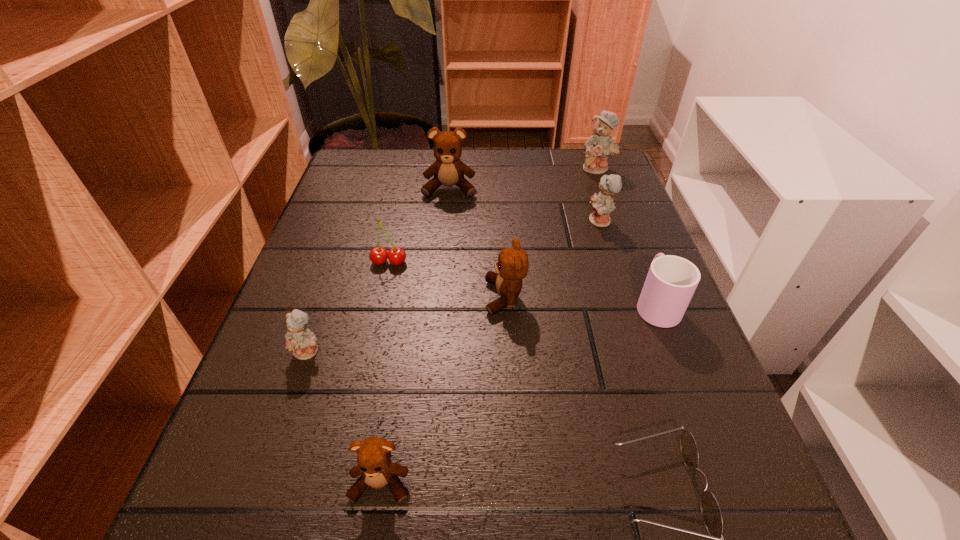
Locate an element on the screen. teddy bear that can be found as the second closest to the smallest blue teddy bear is located at coordinates (512, 266).

Identify which brown teddy bear is the third nearest to the second nearest blue teddy bear. Please provide its 2D coordinates. Your answer should be formatted as a tuple, i.e. [(x, y)], where the tuple contains the x and y coordinates of a point satisfying the conditions above.

[(374, 460)]

I want to click on brown teddy bear that is the second closest to the farthest brown teddy bear, so click(374, 460).

Point out which blue teddy bear is positioned as the nearest to the third farthest teddy bear. Please provide its 2D coordinates. Your answer should be formatted as a tuple, i.e. [(x, y)], where the tuple contains the x and y coordinates of a point satisfying the conditions above.

[(598, 147)]

Identify the location of blue teddy bear that is the closest one to the biggest blue teddy bear. This screenshot has height=540, width=960. (602, 204).

I want to click on free location that satisfies the following two spatial constraints: 1. on the front-facing side of the second farthest blue teddy bear; 2. with the handle on the side of the cup, so click(627, 304).

This screenshot has width=960, height=540. What are the coordinates of `blank space that satisfies the following two spatial constraints: 1. on the front-facing side of the farthest object; 2. on the front-facing side of the fourth teddy bear from left to right` in the screenshot? It's located at (644, 297).

The image size is (960, 540). I want to click on free space that satisfies the following two spatial constraints: 1. with the handle on the side of the cup; 2. on the front-facing side of the third nearest teddy bear, so click(x=654, y=297).

Where is `free spot that satisfies the following two spatial constraints: 1. on the front-facing side of the second biggest blue teddy bear; 2. on the front-facing side of the nearest brown teddy bear`? free spot that satisfies the following two spatial constraints: 1. on the front-facing side of the second biggest blue teddy bear; 2. on the front-facing side of the nearest brown teddy bear is located at coordinates (684, 483).